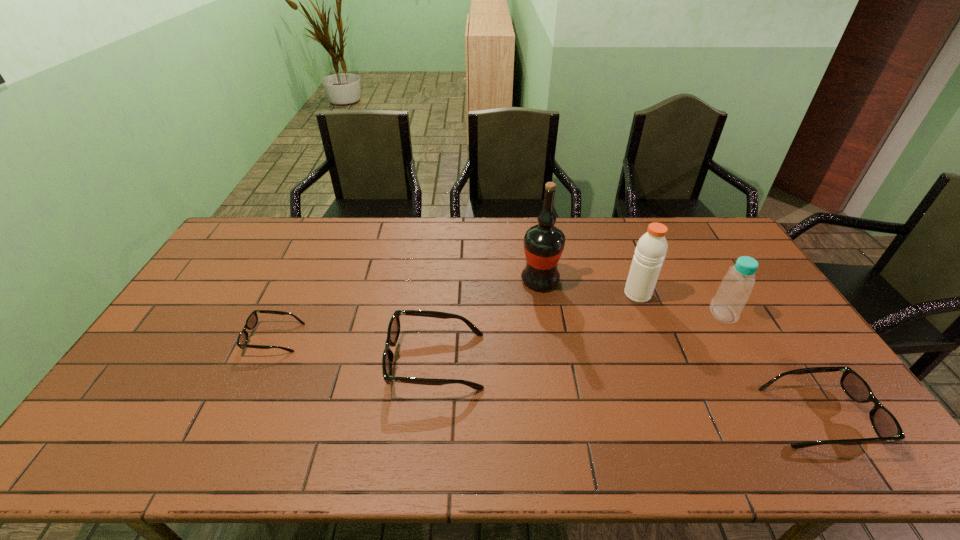
This screenshot has width=960, height=540. What are the coordinates of `bottle located at the right edge` in the screenshot? It's located at (735, 288).

Identify the location of object situated at the near right corner. The width and height of the screenshot is (960, 540). (884, 423).

What are the coordinates of `vacant space at the far edge of the desktop` in the screenshot? It's located at (327, 228).

This screenshot has width=960, height=540. I want to click on vacant space at the near edge of the desktop, so click(x=381, y=397).

In the image, there is a desktop. Find the location of `vacant space at the left edge`. vacant space at the left edge is located at coordinates (232, 295).

In the image, there is a desktop. Where is `vacant space at the right edge`? vacant space at the right edge is located at coordinates (769, 320).

Find the location of a particular element. The width and height of the screenshot is (960, 540). free region at the near left corner is located at coordinates (126, 405).

Identify the location of vacant space at the far right corner. This screenshot has width=960, height=540. (731, 247).

Locate an element on the screen. The width and height of the screenshot is (960, 540). vacant space at the near right corner of the desktop is located at coordinates click(812, 390).

Image resolution: width=960 pixels, height=540 pixels. I want to click on free space that is in between the shortest spectacles and the fourth shortest object, so click(498, 326).